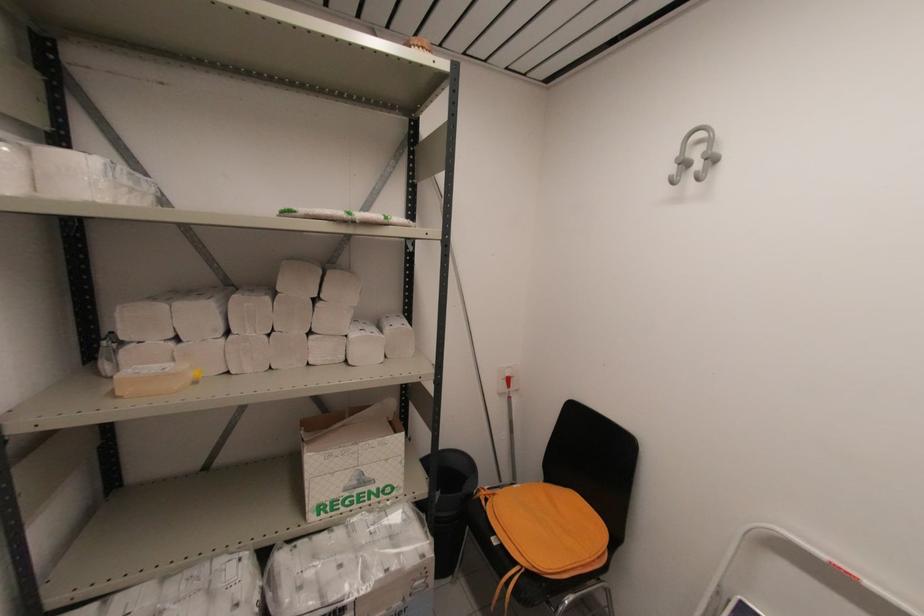
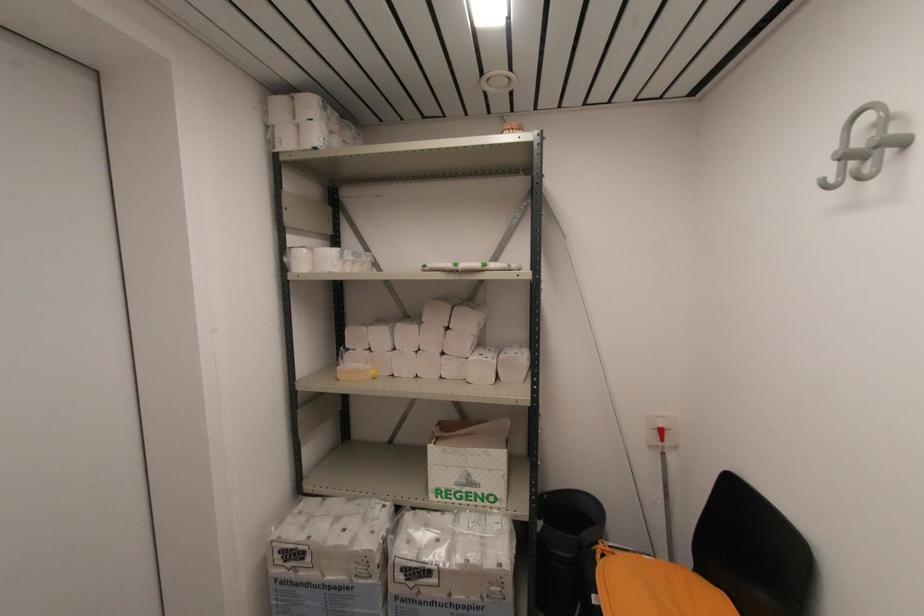
Where in the second image is the point corresponding to [120,398] from the first image?

(339, 381)